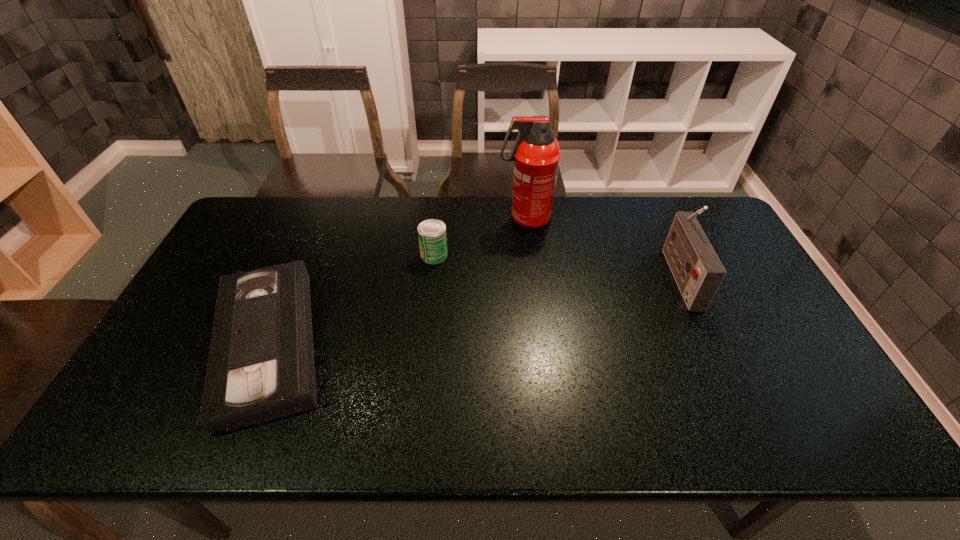
You are a GUI agent. You are given a task and a screenshot of the screen. Output one action in this format:
    pyautogui.click(x=<x>, y=<y>)
    Task: Click on the free space at the far edge of the desktop
    This screenshot has height=540, width=960.
    Given the screenshot: What is the action you would take?
    pyautogui.click(x=395, y=237)

Find the location of a particular element. vacant area at the near edge is located at coordinates (735, 444).

The height and width of the screenshot is (540, 960). I want to click on free region at the left edge of the desktop, so click(221, 271).

Locate an element on the screen. This screenshot has height=540, width=960. vacant space at the right edge of the desktop is located at coordinates (786, 334).

You are a GUI agent. You are given a task and a screenshot of the screen. Output one action in this format:
    pyautogui.click(x=<x>, y=<y>)
    Task: Click on the vacant space at the far left corner of the desktop
    Image resolution: width=960 pixels, height=540 pixels.
    Given the screenshot: What is the action you would take?
    pyautogui.click(x=262, y=234)

Where is `free spot between the third tallest object and the rightmost object`? The height and width of the screenshot is (540, 960). free spot between the third tallest object and the rightmost object is located at coordinates (557, 265).

The width and height of the screenshot is (960, 540). I want to click on unoccupied position between the third object from right to left and the videotape, so click(x=351, y=299).

Locate an element on the screen. Image resolution: width=960 pixels, height=540 pixels. free spot between the videotape and the rightmost object is located at coordinates (473, 310).

Locate an element on the screen. The width and height of the screenshot is (960, 540). vacant space that's between the tallest object and the can is located at coordinates (480, 237).

Identify the location of free spot between the radio receiver and the videotape. (473, 310).